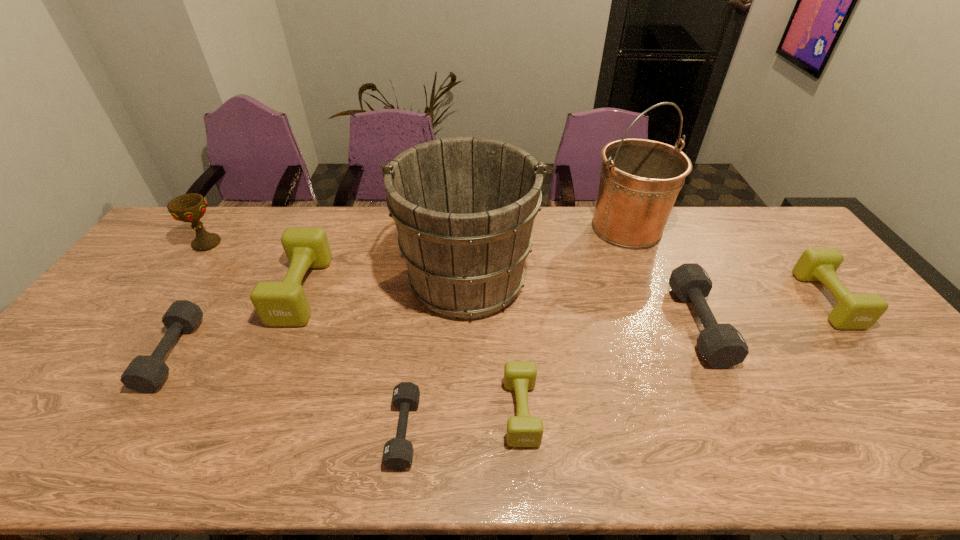
Locate an element on the screen. The height and width of the screenshot is (540, 960). the leftmost gray dumbbell is located at coordinates (145, 373).

Identify the location of the second object from left to right. The image size is (960, 540). (145, 373).

Locate an element on the screen. The image size is (960, 540). the second olive dumbbell from right to left is located at coordinates (523, 430).

Locate an element on the screen. The height and width of the screenshot is (540, 960). the smallest olive dumbbell is located at coordinates (523, 430).

At what (x,y) coordinates should I click in order to perform the action: click on the shortest object. Please return your answer as a coordinate pair (x, y). The image size is (960, 540). Looking at the image, I should click on (398, 452).

Identify the location of the nearest gray dumbbell. [x=398, y=452].

Find the location of a particular element. vacant region located on the left of the right bucket is located at coordinates (516, 228).

Where is `free space located 0.110m on the handle side of the left bucket`? This screenshot has width=960, height=540. free space located 0.110m on the handle side of the left bucket is located at coordinates (468, 214).

You are a GUI agent. You are given a task and a screenshot of the screen. Output one action in this format:
    pyautogui.click(x=<x>, y=<y>)
    Task: Click on the vacant position located on the front of the red chalice
    The width and height of the screenshot is (960, 540).
    Given the screenshot: What is the action you would take?
    pyautogui.click(x=135, y=342)

Where is `vacant point located 0.080m on the back of the fourth tallest object`? The image size is (960, 540). vacant point located 0.080m on the back of the fourth tallest object is located at coordinates (322, 242).